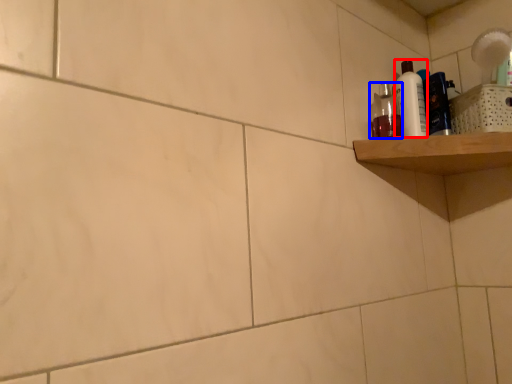
Question: Which object is further to the camera taking this photo, cleaning product (highlighted by a red box) or mouthwash (highlighted by a blue box)?

Choices:
 (A) cleaning product
 (B) mouthwash

Answer: (A)